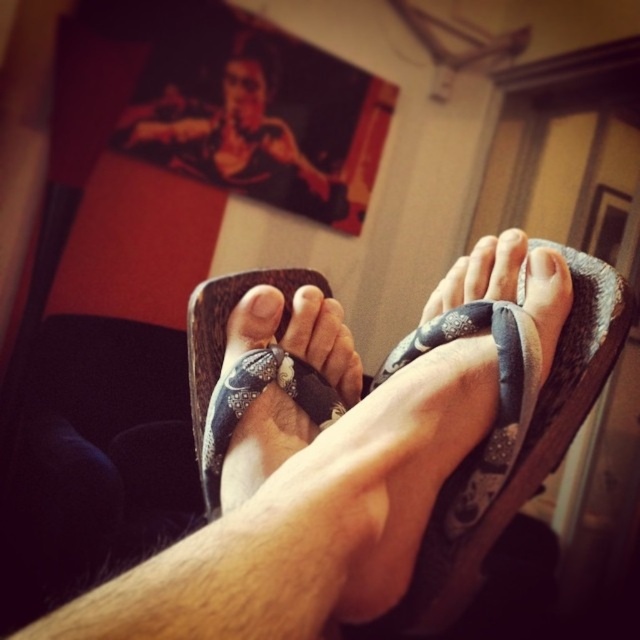
Question: Can you confirm if leather sandals at center is positioned to the right of matte gray sandal at center?

Choices:
 (A) no
 (B) yes

Answer: (A)

Question: Among these points, which one is farthest from the camera?

Choices:
 (A) (193, 369)
 (B) (337, 147)
 (C) (600, 365)
 (D) (252, 554)

Answer: (B)

Question: Which of these objects is positioned farthest from the gray fabric sandal at center?

Choices:
 (A) leather sandals at center
 (B) matte black flip-flops at lower center

Answer: (B)

Question: Among these points, which one is farthest from the camera?

Choices:
 (A) (342, 392)
 (B) (256, 52)
 (C) (392, 417)

Answer: (B)

Question: Is leather sandals at center bigger than gray fabric sandal at center?

Choices:
 (A) no
 (B) yes

Answer: (B)

Question: Does leather sandal at center have a greater width compared to white matte toe at center?

Choices:
 (A) no
 (B) yes

Answer: (B)